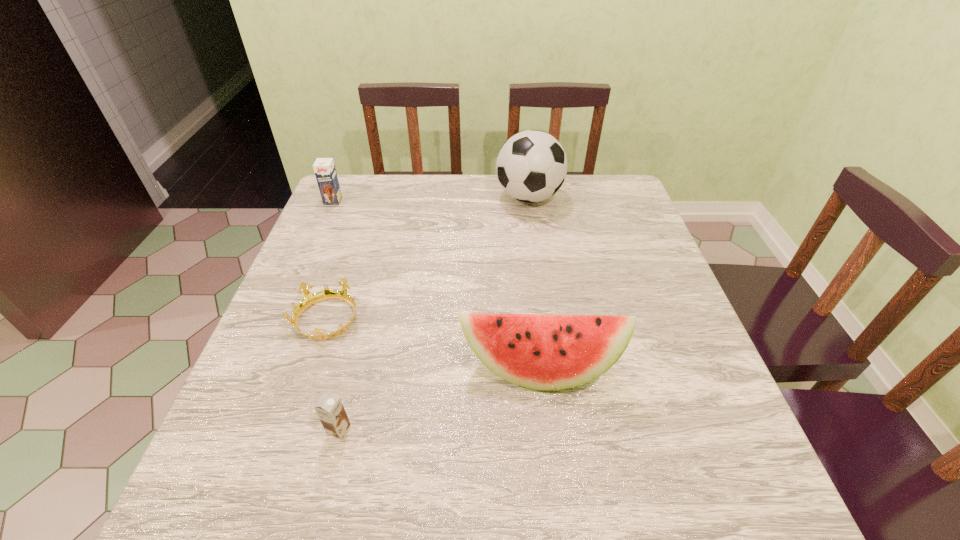
The width and height of the screenshot is (960, 540). I want to click on soccer ball, so click(531, 166).

Find the location of `the fourth shortest object`. the fourth shortest object is located at coordinates (544, 352).

Image resolution: width=960 pixels, height=540 pixels. Find the location of `the farther chocolate milk`. the farther chocolate milk is located at coordinates (324, 168).

The image size is (960, 540). I want to click on the third tallest object, so click(324, 168).

Find the location of a particular element. The height and width of the screenshot is (540, 960). the nearest object is located at coordinates (331, 412).

Find the location of `the right chocolate milk`. the right chocolate milk is located at coordinates (331, 412).

The width and height of the screenshot is (960, 540). In order to click on crown in this screenshot , I will do `click(310, 299)`.

Find the location of a particular element. vacant area situated on the left of the soccer ball is located at coordinates (372, 197).

Image resolution: width=960 pixels, height=540 pixels. I want to click on vacant region located on the outer rind of the watermelon, so click(x=552, y=489).

You are a GUI agent. You are given a task and a screenshot of the screen. Output one action in this format:
    pyautogui.click(x=<x>, y=<y>)
    Task: Click on the free space located 0.090m on the front label of the left chocolate milk
    Image resolution: width=960 pixels, height=540 pixels.
    Given the screenshot: What is the action you would take?
    pyautogui.click(x=324, y=223)